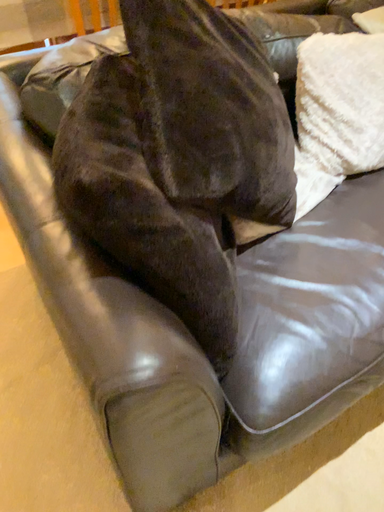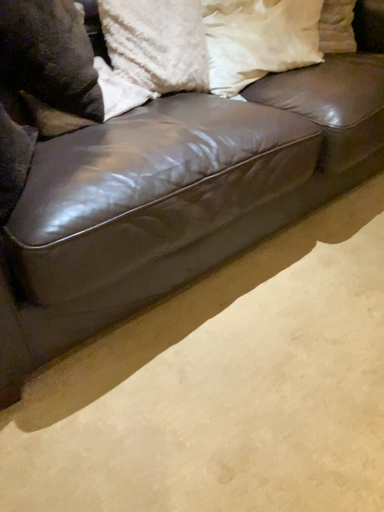
Question: How did the camera likely rotate when shooting the video?

Choices:
 (A) rotated downward
 (B) rotated upward

Answer: (B)